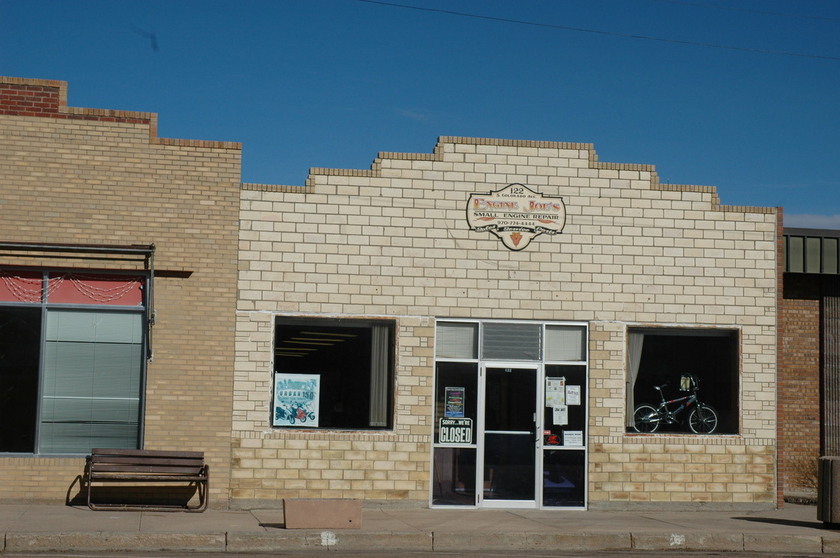
In order to click on bench in this screenshot , I will do `click(150, 485)`.